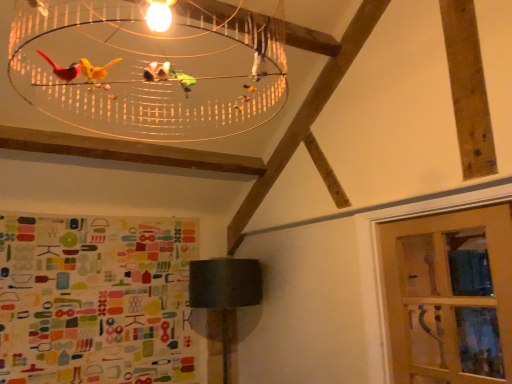
Question: Should I look upward or downward to see translucent plastic birdcage at upper center?

Choices:
 (A) down
 (B) up

Answer: (B)

Question: From the image's perspective, does clear glass door at lower right appear higher than matte black lampshade at lower center?

Choices:
 (A) no
 (B) yes

Answer: (B)

Question: Is matte black lampshade at lower center inside clear glass door at lower right?

Choices:
 (A) yes
 (B) no

Answer: (B)

Question: Is clear glass door at lower right at the right side of matte black lampshade at lower center?

Choices:
 (A) yes
 (B) no

Answer: (A)

Question: Is clear glass door at lower right positioned in front of matte black lampshade at lower center?

Choices:
 (A) yes
 (B) no

Answer: (A)

Question: Is clear glass door at lower right positioned far away from matte black lampshade at lower center?

Choices:
 (A) no
 (B) yes

Answer: (B)

Question: Is clear glass door at lower right looking in the opposite direction of matte black lampshade at lower center?

Choices:
 (A) yes
 (B) no

Answer: (B)

Question: Is translucent plastic birdcage at upper center inside clear glass door at lower right?

Choices:
 (A) no
 (B) yes

Answer: (A)

Question: Can you confirm if clear glass door at lower right is smaller than translucent plastic birdcage at upper center?

Choices:
 (A) yes
 (B) no

Answer: (A)

Question: From the image's perspective, is clear glass door at lower right located above translucent plastic birdcage at upper center?

Choices:
 (A) no
 (B) yes

Answer: (A)

Question: Can you confirm if clear glass door at lower right is bigger than translucent plastic birdcage at upper center?

Choices:
 (A) no
 (B) yes

Answer: (A)

Question: Does clear glass door at lower right appear on the right side of translucent plastic birdcage at upper center?

Choices:
 (A) no
 (B) yes

Answer: (B)

Question: Is clear glass door at lower right looking in the opposite direction of translucent plastic birdcage at upper center?

Choices:
 (A) no
 (B) yes

Answer: (A)

Question: Is translucent plastic birdcage at upper center positioned in front of clear glass door at lower right?

Choices:
 (A) no
 (B) yes

Answer: (B)